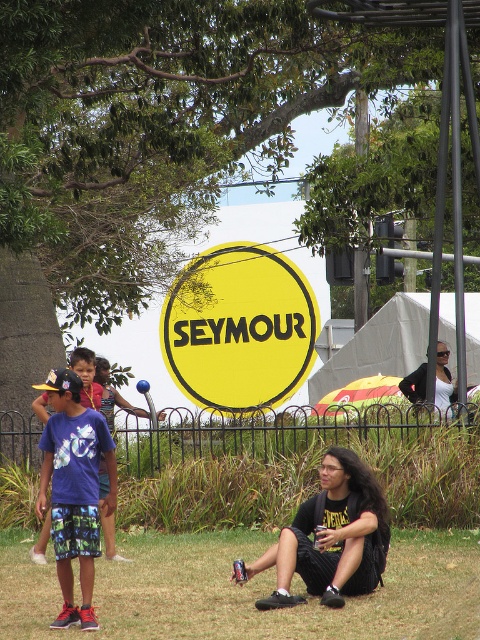
Can you confirm if green grass at lower center is smaller than black fabric backpack at lower center?

Correct, green grass at lower center occupies less space than black fabric backpack at lower center.

Does green grass at lower center have a lesser width compared to black fabric backpack at lower center?

Correct, green grass at lower center's width is less than black fabric backpack at lower center's.

Does point (187, 554) lie behind point (324, 589)?

Yes, point (187, 554) is behind point (324, 589).

Identify the location of green grass at lower center. (244, 592).

From the picture: Which of these two, yellow matte sign at center or black fabric backpack at lower center, stands shorter?

black fabric backpack at lower center is shorter.

Is point (200, 262) in front of point (323, 536)?

No, (200, 262) is behind (323, 536).

At what (x,y) coordinates should I click in order to perform the action: click on yellow matte sign at center. Please return your answer as a coordinate pair (x, y). This screenshot has width=480, height=640. Looking at the image, I should click on (239, 326).

The height and width of the screenshot is (640, 480). In order to click on yellow matte sign at center in this screenshot , I will do `click(239, 326)`.

Is point (303, 627) positioned after point (440, 410)?

No, it is not.

Between green grass at lower center and white matte shirt at upper right, which one appears on the left side from the viewer's perspective?

From the viewer's perspective, green grass at lower center appears more on the left side.

Who is more distant from viewer, (354,598) or (418,392)?

Point (418,392)

The height and width of the screenshot is (640, 480). I want to click on green grass at lower center, so click(x=244, y=592).